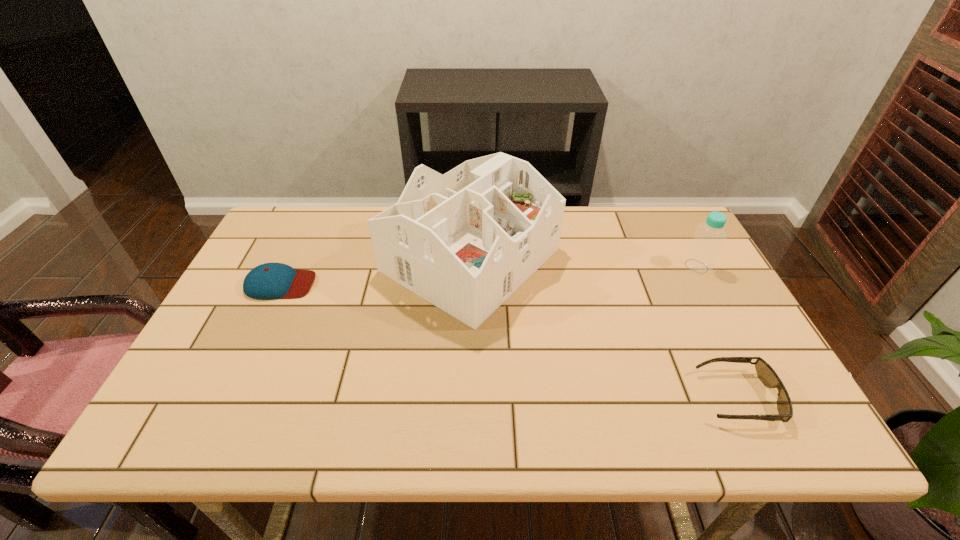
Where is `free location located 0.180m on the front-facing side of the nearest object`? The image size is (960, 540). free location located 0.180m on the front-facing side of the nearest object is located at coordinates (619, 397).

Identify the location of object located in the far edge section of the desktop. (465, 241).

Identify the location of object that is positioned at the near edge. This screenshot has height=540, width=960. (766, 374).

Identify the location of object located at the left edge. (267, 281).

Locate an element on the screen. The width and height of the screenshot is (960, 540). bottle that is at the right edge is located at coordinates (702, 252).

The height and width of the screenshot is (540, 960). Find the location of `sunglasses at the right edge`. sunglasses at the right edge is located at coordinates (766, 374).

Image resolution: width=960 pixels, height=540 pixels. I want to click on object located in the near right corner section of the desktop, so click(x=766, y=374).

In the image, there is a desktop. Where is `vacant space at the far edge`? This screenshot has height=540, width=960. vacant space at the far edge is located at coordinates (570, 241).

In order to click on vacant area at the near edge in this screenshot , I will do `click(423, 418)`.

Where is `vacant area at the left edge of the desktop`? The image size is (960, 540). vacant area at the left edge of the desktop is located at coordinates (221, 377).